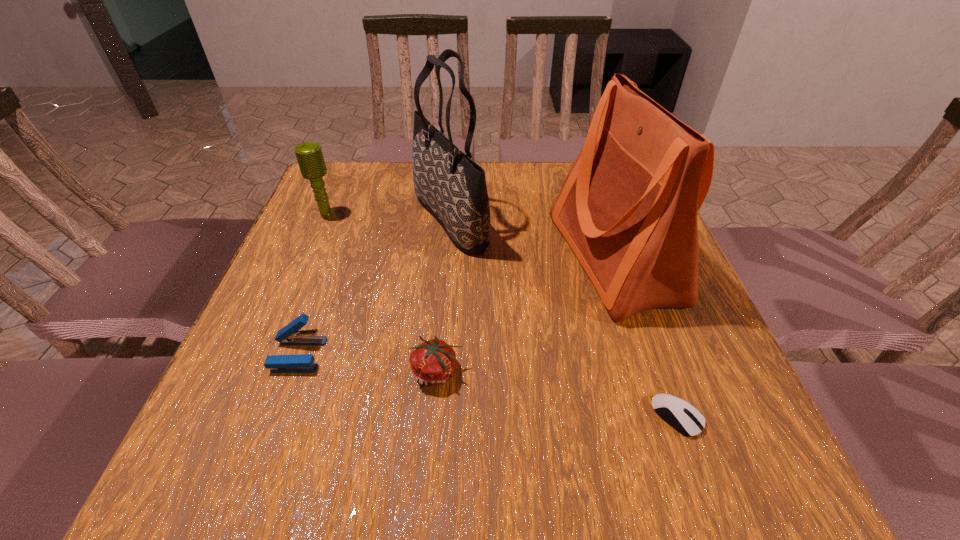
You are a GUI agent. You are given a task and a screenshot of the screen. Output one action in this format:
    pyautogui.click(x=<x>, y=<y>)
    Task: Click on the free location located on the right of the stapler
    
    Given the screenshot: What is the action you would take?
    490,355

The width and height of the screenshot is (960, 540). I want to click on vacant space situated 0.230m on the left of the tomato, so click(x=283, y=372).

Find the location of a particular element. This screenshot has height=540, width=960. free location located on the back of the shortest object is located at coordinates (643, 320).

Identify the location of tote bag located in the far edge section of the desktop. (452, 187).

This screenshot has width=960, height=540. Find the location of `shopping bag present at the far edge`. shopping bag present at the far edge is located at coordinates (628, 207).

Locate an element on the screen. The width and height of the screenshot is (960, 540). microphone present at the far edge is located at coordinates coord(309,155).

Locate an element on the screen. This screenshot has height=540, width=960. object located in the near edge section of the desktop is located at coordinates (685, 418).

Find the location of `microphone present at the left edge`. microphone present at the left edge is located at coordinates (309, 155).

This screenshot has height=540, width=960. Identify the location of stapler positioned at the left edge. (291, 334).

The width and height of the screenshot is (960, 540). Find the location of `shopping bag at the right edge`. shopping bag at the right edge is located at coordinates (628, 207).